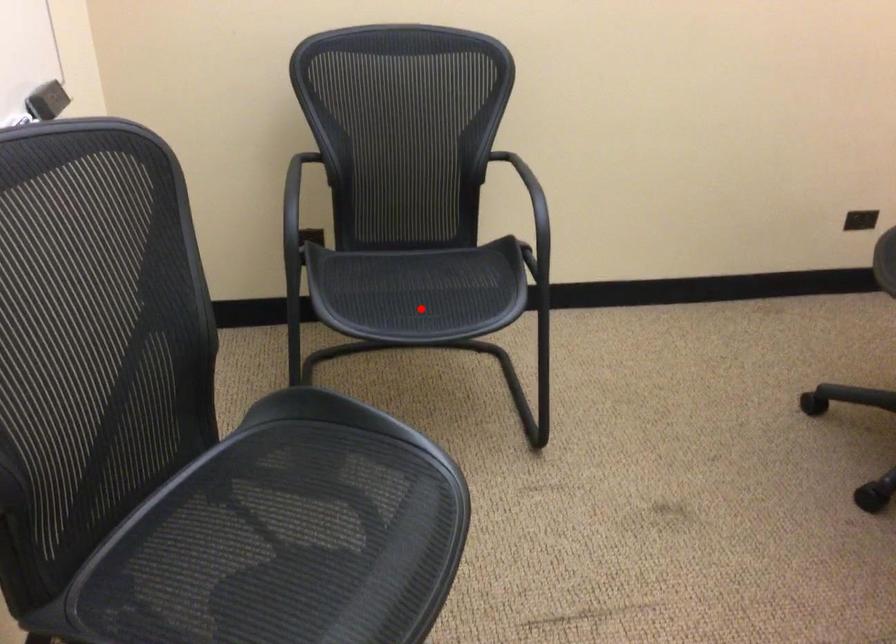
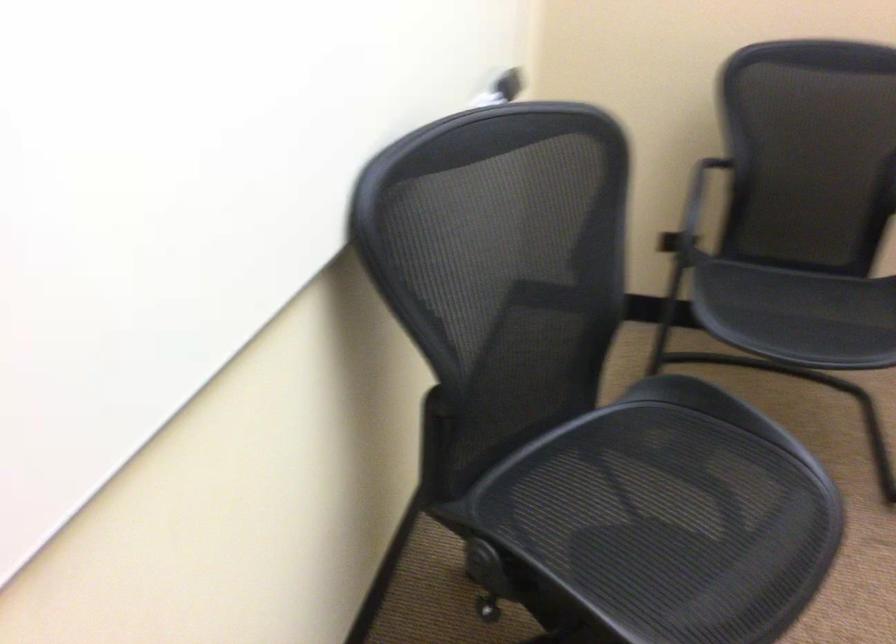
Question: I am providing you with two images of the same scene from different viewpoints. A red point is marked on the first image. Can you still see the location of the red point in image 2?

Choices:
 (A) Yes
 (B) No

Answer: (A)